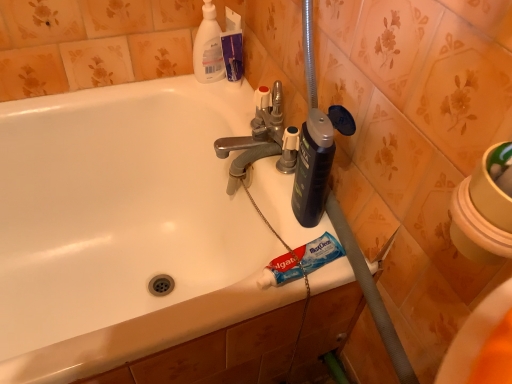
Question: Considering the relative sizes of white glossy bathtub at center and polished chrome faucet at center in the image provided, is white glossy bathtub at center bigger than polished chrome faucet at center?

Choices:
 (A) yes
 (B) no

Answer: (A)

Question: From the image's perspective, is white glossy bathtub at center on top of polished chrome faucet at center?

Choices:
 (A) no
 (B) yes

Answer: (A)

Question: Could you tell me if white glossy bathtub at center is turned towards polished chrome faucet at center?

Choices:
 (A) no
 (B) yes

Answer: (A)

Question: From a real-world perspective, is white glossy bathtub at center over polished chrome faucet at center?

Choices:
 (A) yes
 (B) no

Answer: (B)

Question: Can you confirm if white glossy bathtub at center is smaller than polished chrome faucet at center?

Choices:
 (A) no
 (B) yes

Answer: (A)

Question: Is white glossy bathtub at center taller or shorter than white plastic bottle at upper center?

Choices:
 (A) short
 (B) tall

Answer: (B)

Question: In the image, is white glossy bathtub at center on the left side or the right side of white plastic bottle at upper center?

Choices:
 (A) left
 (B) right

Answer: (A)

Question: Is white glossy bathtub at center spatially inside white plastic bottle at upper center, or outside of it?

Choices:
 (A) outside
 (B) inside

Answer: (A)

Question: From a real-world perspective, is white glossy bathtub at center physically located above or below white plastic bottle at upper center?

Choices:
 (A) below
 (B) above

Answer: (A)

Question: In terms of height, does white plastic bottle at upper center look taller or shorter compared to polished chrome faucet at center?

Choices:
 (A) short
 (B) tall

Answer: (B)

Question: From a real-world perspective, relative to polished chrome faucet at center, is white plastic bottle at upper center vertically above or below?

Choices:
 (A) above
 (B) below

Answer: (A)

Question: From the image's perspective, relative to polished chrome faucet at center, is white plastic bottle at upper center above or below?

Choices:
 (A) below
 (B) above

Answer: (B)

Question: Is white plastic bottle at upper center wider or thinner than polished chrome faucet at center?

Choices:
 (A) thin
 (B) wide

Answer: (A)

Question: From a real-world perspective, is white plastic bottle at upper center above or below blue matte toothpaste at lower center?

Choices:
 (A) below
 (B) above

Answer: (B)

Question: Choose the correct answer: Is white plastic bottle at upper center inside blue matte toothpaste at lower center or outside it?

Choices:
 (A) outside
 (B) inside

Answer: (A)